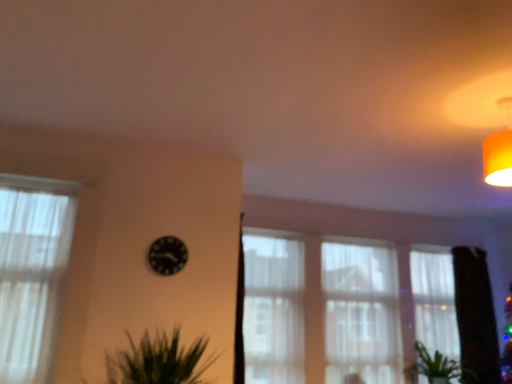
The height and width of the screenshot is (384, 512). I want to click on black glossy clock at center, so click(167, 255).

Describe the element at coordinates (32, 271) in the screenshot. The height and width of the screenshot is (384, 512). I see `white sheer curtain at left, the fourth curtain viewed from the right` at that location.

This screenshot has height=384, width=512. What do you see at coordinates (361, 313) in the screenshot? I see `white sheer curtain at center, the 2th curtain viewed from the back` at bounding box center [361, 313].

Identify the location of white sheer curtain at center, which is the 3th curtain from front to back. (361, 313).

Identify the location of white sheer curtain at right, the 1th curtain from the right. Image resolution: width=512 pixels, height=384 pixels. (435, 302).

Describe the element at coordinates (435, 302) in the screenshot. I see `white sheer curtain at right, acting as the fourth curtain starting from the front` at that location.

I want to click on green matte tree at right, so click(475, 317).

What do you see at coordinates (273, 308) in the screenshot?
I see `white sheer curtain at center, which is counted as the second curtain, starting from the front` at bounding box center [273, 308].

Find the location of `black glossy clock at center`. black glossy clock at center is located at coordinates (167, 255).

Is orange fabric lampshade at upper right not within white sheer curtain at right, the 1th curtain from the right?

Yes, orange fabric lampshade at upper right is located beyond the bounds of white sheer curtain at right, the 1th curtain from the right.

Does orange fabric lampshade at upper right touch white sheer curtain at right, the fourth curtain in the left-to-right sequence?

No, orange fabric lampshade at upper right is not with white sheer curtain at right, the fourth curtain in the left-to-right sequence.

From the image's perspective, is orange fabric lampshade at upper right located above or below white sheer curtain at right, the fourth curtain in the left-to-right sequence?

Based on their image positions, orange fabric lampshade at upper right is located above white sheer curtain at right, the fourth curtain in the left-to-right sequence.

Which object is more forward, orange fabric lampshade at upper right or white sheer curtain at right, the 1th curtain from the right?

orange fabric lampshade at upper right.

Looking at this image, does white sheer curtain at center, which is counted as the second curtain, starting from the front, have a lesser width compared to orange fabric lampshade at upper right?

Indeed, white sheer curtain at center, which is counted as the second curtain, starting from the front, has a lesser width compared to orange fabric lampshade at upper right.

Is white sheer curtain at center, which is counted as the second curtain, starting from the front, looking in the opposite direction of orange fabric lampshade at upper right?

No, orange fabric lampshade at upper right is not at the back of white sheer curtain at center, which is counted as the second curtain, starting from the front.

Is orange fabric lampshade at upper right completely or partially inside white sheer curtain at center, which is counted as the second curtain, starting from the front?

No, orange fabric lampshade at upper right is not surrounded by white sheer curtain at center, which is counted as the second curtain, starting from the front.

From the image's perspective, is white sheer curtain at center, the 2th curtain when ordered from left to right, above or below orange fabric lampshade at upper right?

white sheer curtain at center, the 2th curtain when ordered from left to right, is below orange fabric lampshade at upper right.

Would you consider green leafy plant at lower right to be distant from white sheer curtain at center, the third curtain positioned from the back?

Yes, green leafy plant at lower right is far from white sheer curtain at center, the third curtain positioned from the back.

Does green leafy plant at lower right appear on the right side of white sheer curtain at center, the third curtain positioned from the back?

Correct, you'll find green leafy plant at lower right to the right of white sheer curtain at center, the third curtain positioned from the back.

Measure the distance from green leafy plant at lower right to white sheer curtain at center, the 3th curtain when ordered from right to left.

4.82 feet.

Is green leafy plant at lower right oriented towards white sheer curtain at center, the 3th curtain when ordered from right to left?

No, green leafy plant at lower right is not oriented towards white sheer curtain at center, the 3th curtain when ordered from right to left.

Consider the image. Is white sheer curtain at right, the fourth curtain in the left-to-right sequence, wider than green matte tree at right?

Incorrect, the width of white sheer curtain at right, the fourth curtain in the left-to-right sequence, does not surpass that of green matte tree at right.

Does white sheer curtain at right, the 1th curtain from the right, appear on the left side of green matte tree at right?

Yes, white sheer curtain at right, the 1th curtain from the right, is to the left of green matte tree at right.

Is white sheer curtain at right, the fourth curtain in the left-to-right sequence, bigger than green matte tree at right?

No.

From the image's perspective, who appears lower, white sheer curtain at right, arranged as the 1th curtain when viewed from the back, or green matte tree at right?

From the image's view, white sheer curtain at right, arranged as the 1th curtain when viewed from the back, is below.

From a real-world perspective, relative to white sheer curtain at center, which is the 3th curtain in left-to-right order, is orange fabric lampshade at upper right vertically above or below?

From a real-world perspective, orange fabric lampshade at upper right is physically above white sheer curtain at center, which is the 3th curtain in left-to-right order.

Considering the relative sizes of orange fabric lampshade at upper right and white sheer curtain at center, the second curtain from the right, in the image provided, is orange fabric lampshade at upper right taller than white sheer curtain at center, the second curtain from the right,?

In fact, orange fabric lampshade at upper right may be shorter than white sheer curtain at center, the second curtain from the right.

This screenshot has height=384, width=512. In order to click on light fixture that is on the right side of white sheer curtain at center, the 2th curtain viewed from the back in this screenshot , I will do `click(499, 150)`.

Does orange fabric lampshade at upper right touch white sheer curtain at center, the second curtain from the right?

No, orange fabric lampshade at upper right is not beside white sheer curtain at center, the second curtain from the right.

Is white sheer curtain at right, the 1th curtain from the right, to the left of white sheer curtain at left, positioned as the fourth curtain in back-to-front order, from the viewer's perspective?

In fact, white sheer curtain at right, the 1th curtain from the right, is to the right of white sheer curtain at left, positioned as the fourth curtain in back-to-front order.

From a real-world perspective, is white sheer curtain at right, the fourth curtain in the left-to-right sequence, positioned above or below white sheer curtain at left, arranged as the 1th curtain when viewed from the front?

From a real-world perspective, white sheer curtain at right, the fourth curtain in the left-to-right sequence, is physically below white sheer curtain at left, arranged as the 1th curtain when viewed from the front.

Measure the distance between white sheer curtain at right, acting as the fourth curtain starting from the front, and white sheer curtain at left, marked as the 1th curtain in a left-to-right arrangement.

white sheer curtain at right, acting as the fourth curtain starting from the front, and white sheer curtain at left, marked as the 1th curtain in a left-to-right arrangement, are 3.55 meters apart from each other.

Is white sheer curtain at center, the second curtain from the right, smaller than green leafy plant at lower right?

Actually, white sheer curtain at center, the second curtain from the right, might be larger than green leafy plant at lower right.

From the image's perspective, which one is positioned lower, white sheer curtain at center, which is the 3th curtain from front to back, or green leafy plant at lower right?

green leafy plant at lower right appears lower in the image.

Considering the points (344, 309) and (419, 348), which point is in front, point (344, 309) or point (419, 348)?

The point (344, 309) is closer.

The height and width of the screenshot is (384, 512). What are the coordinates of `light fixture in front of the white sheer curtain at right, acting as the fourth curtain starting from the front` in the screenshot? It's located at (499, 150).

There is a orange fabric lampshade at upper right. At what (x,y) coordinates should I click in order to perform the action: click on the 2nd curtain below it (from a real-world perspective). Please return your answer as a coordinate pair (x, y). This screenshot has width=512, height=384. Looking at the image, I should click on (273, 308).

Looking at the image, which one is located closer to white sheer curtain at right, acting as the fourth curtain starting from the front, orange fabric lampshade at upper right or white sheer curtain at center, which is the 3th curtain from front to back?

Among the two, white sheer curtain at center, which is the 3th curtain from front to back, is located nearer to white sheer curtain at right, acting as the fourth curtain starting from the front.

From the image, which object appears to be nearer to white sheer curtain at center, the 2th curtain viewed from the back, black glossy clock at center or green leafy plant at lower right?

Based on the image, green leafy plant at lower right appears to be nearer to white sheer curtain at center, the 2th curtain viewed from the back.

Based on their spatial positions, is white sheer curtain at right, the fourth curtain in the left-to-right sequence, or white sheer curtain at center, which is the 3th curtain from front to back, further from white sheer curtain at left, positioned as the fourth curtain in back-to-front order?

The object further to white sheer curtain at left, positioned as the fourth curtain in back-to-front order, is white sheer curtain at right, the fourth curtain in the left-to-right sequence.

When comparing their distances from orange fabric lampshade at upper right, does green leafy plant at lower right or white sheer curtain at center, which is the 3th curtain in left-to-right order, seem closer?

white sheer curtain at center, which is the 3th curtain in left-to-right order, is positioned closer to the anchor orange fabric lampshade at upper right.

When comparing their distances from green leafy plant at lower right, does orange fabric lampshade at upper right or green matte tree at right seem further?

orange fabric lampshade at upper right is positioned further to the anchor green leafy plant at lower right.

From the image, which object appears to be nearer to black glossy clock at center, green matte tree at right or white sheer curtain at center, which is the 3th curtain from front to back?

white sheer curtain at center, which is the 3th curtain from front to back, is positioned closer to the anchor black glossy clock at center.

Based on their spatial positions, is black glossy clock at center or white sheer curtain at left, arranged as the 1th curtain when viewed from the front, further from green leafy plant at lower right?

→ white sheer curtain at left, arranged as the 1th curtain when viewed from the front, lies further to green leafy plant at lower right than the other object.

Considering their positions, is white sheer curtain at left, marked as the 1th curtain in a left-to-right arrangement, positioned further to white sheer curtain at center, the 3th curtain when ordered from right to left, than green matte tree at right?

white sheer curtain at left, marked as the 1th curtain in a left-to-right arrangement, is further to white sheer curtain at center, the 3th curtain when ordered from right to left.

Find the location of a particular element. This screenshot has width=512, height=384. clock situated between white sheer curtain at left, marked as the 1th curtain in a left-to-right arrangement, and orange fabric lampshade at upper right from left to right is located at coordinates (167, 255).

In order to click on plant between white sheer curtain at center, the 3th curtain when ordered from right to left, and green matte tree at right in this screenshot , I will do `click(433, 366)`.

Where is `light fixture between white sheer curtain at left, marked as the 1th curtain in a left-to-right arrangement, and green leafy plant at lower right`? This screenshot has height=384, width=512. light fixture between white sheer curtain at left, marked as the 1th curtain in a left-to-right arrangement, and green leafy plant at lower right is located at coordinates (499, 150).

This screenshot has height=384, width=512. In order to click on curtain between white sheer curtain at center, which is the 3th curtain from front to back, and green matte tree at right in this screenshot , I will do `click(435, 302)`.